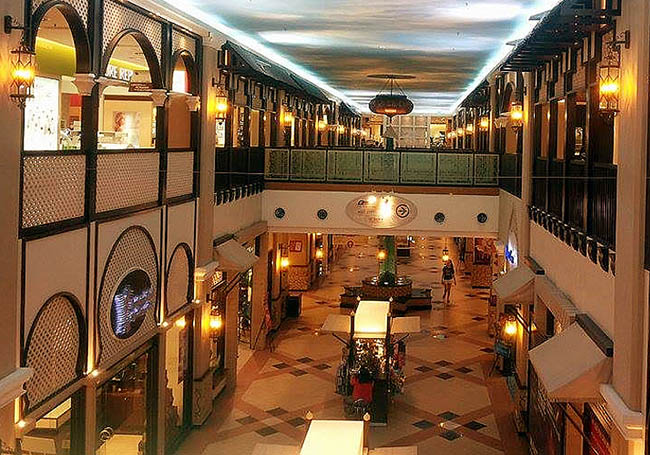
You are a GUI agent. You are given a task and a screenshot of the screen. Output one action in this format:
    pyautogui.click(x=<x>, y=<y>)
    Task: Click on the hood
    The width and height of the screenshot is (650, 455).
    Given the screenshot: What is the action you would take?
    pyautogui.click(x=564, y=368)